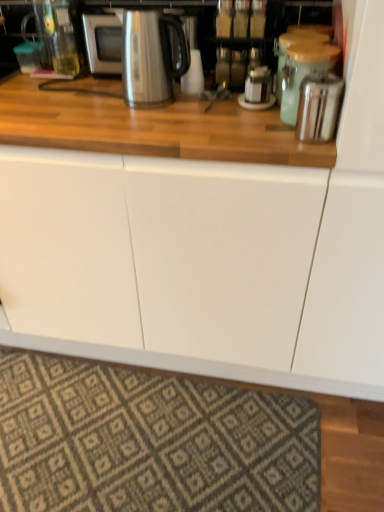
The height and width of the screenshot is (512, 384). In order to click on vacant space underneath patterned carpet at lower center (from a real-world perspective) in this screenshot , I will do `click(147, 447)`.